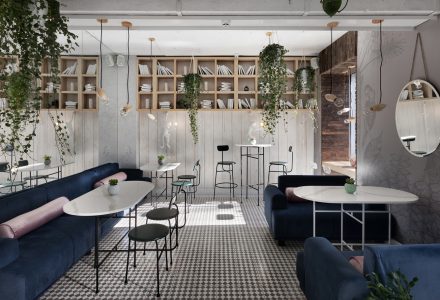
What are the coordinates of `stools` in the screenshot? It's located at (154, 233), (161, 209), (181, 180), (186, 175), (287, 160), (220, 161), (42, 173), (11, 182).